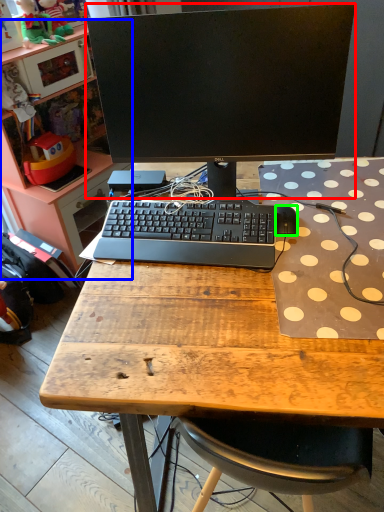
Question: Which object is positioned closest to computer monitor (highlighted by a red box)? Select from bookshelf (highlighted by a blue box) and mouse (highlighted by a green box).

Choices:
 (A) bookshelf
 (B) mouse

Answer: (B)